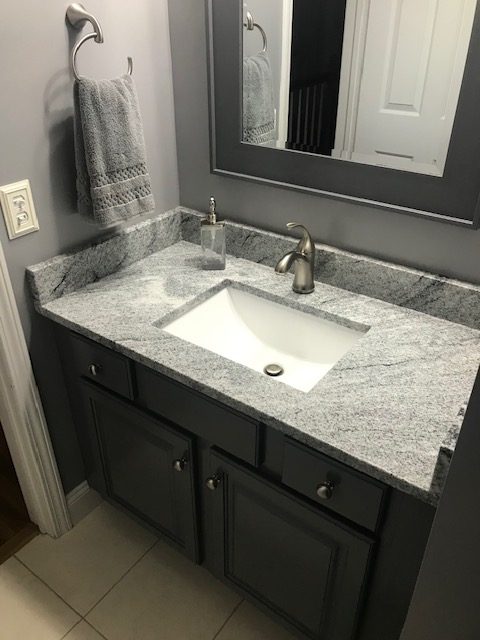
Find the location of a particular element. The height and width of the screenshot is (640, 480). soap dispenser is located at coordinates (211, 244).